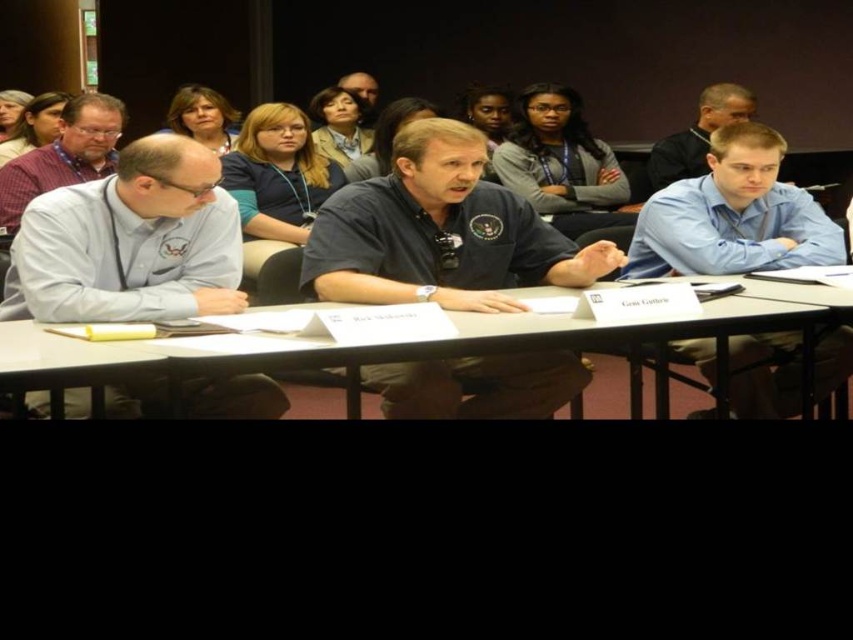
Question: In this image, where is light blue shirt at left located relative to white plastic table at center?

Choices:
 (A) right
 (B) left

Answer: (B)

Question: Does blue shirt at right appear under light brown hair at center?

Choices:
 (A) yes
 (B) no

Answer: (A)

Question: Among these points, which one is farthest from the camera?

Choices:
 (A) (714, 93)
 (B) (448, 349)
 (C) (451, 246)

Answer: (A)

Question: Which point is closer to the camera?

Choices:
 (A) (732, 406)
 (B) (221, 276)
 (C) (723, 205)

Answer: (B)

Question: Does blue shirt at right appear on the right side of light brown hair at center?

Choices:
 (A) no
 (B) yes

Answer: (A)

Question: Among these objects, which one is nearest to the camera?

Choices:
 (A) dark blue shirt at center
 (B) white plastic table at center
 (C) matte purple shirt at left
 (D) blue shirt at right

Answer: (B)